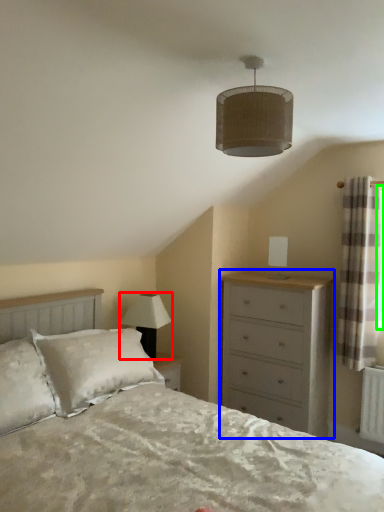
Question: Which object is the closest to the lamp (highlighted by a red box)? Choose among these: chest of drawers (highlighted by a blue box) or window screen (highlighted by a green box).

Choices:
 (A) chest of drawers
 (B) window screen

Answer: (A)